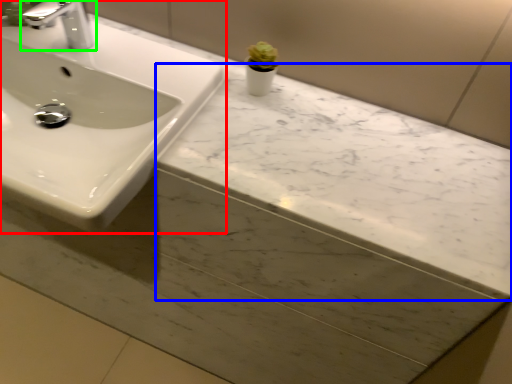
Question: Considering the real-world distances, which object is farthest from sink (highlighted by a red box)? counter top (highlighted by a blue box) or tap (highlighted by a green box)?

Choices:
 (A) counter top
 (B) tap

Answer: (A)